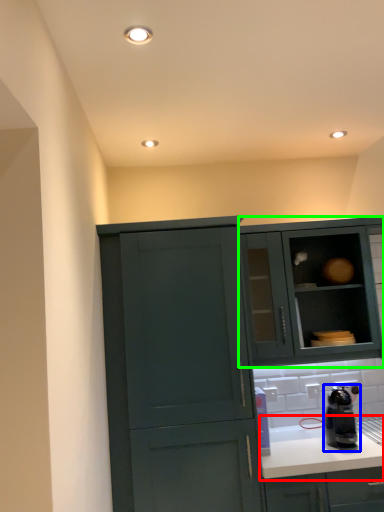
Question: Based on their relative distances, which object is nearer to countertop (highlighted by a red box)? Choose from kitchen appliance (highlighted by a blue box) and cabinetry (highlighted by a green box).

Choices:
 (A) kitchen appliance
 (B) cabinetry

Answer: (A)